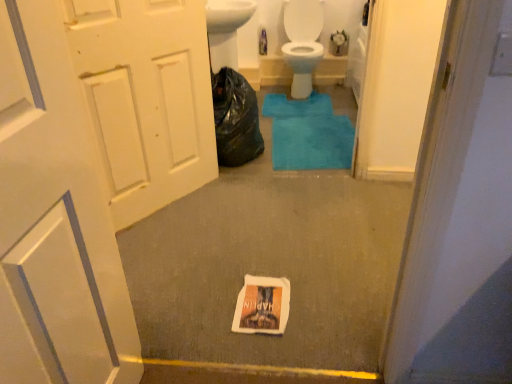
This screenshot has height=384, width=512. I want to click on white glossy toilet at center, so click(302, 65).

The image size is (512, 384). What do you see at coordinates (146, 98) in the screenshot? I see `white matte door at left, which appears as the second door when viewed from the front` at bounding box center [146, 98].

Describe the element at coordinates (234, 119) in the screenshot. This screenshot has width=512, height=384. I see `black plastic bag at center` at that location.

You are a GUI agent. You are given a task and a screenshot of the screen. Output one action in this format:
    pyautogui.click(x=<x>, y=<y>)
    Task: Click on the black plastic bag at center
    
    Given the screenshot: What is the action you would take?
    pyautogui.click(x=234, y=119)

This screenshot has width=512, height=384. I want to click on white matte door at left, arranged as the second door when viewed from the back, so click(x=57, y=211).

Locate an element on the screen. This screenshot has height=384, width=512. white glossy toilet at center is located at coordinates (302, 65).

From the image's perspective, is white matte door at left, the first door in the front-to-back sequence, located above or below white glossy toilet at center?

Based on their image positions, white matte door at left, the first door in the front-to-back sequence, is located beneath white glossy toilet at center.

Considering the relative sizes of white matte door at left, arranged as the second door when viewed from the back, and white glossy toilet at center in the image provided, is white matte door at left, arranged as the second door when viewed from the back, shorter than white glossy toilet at center?

No.

Is point (61, 128) positioned behind point (323, 49)?

No, it is not.

Is white matte door at left, arranged as the second door when viewed from the back, positioned beyond the bounds of white glossy toilet at center?

Yes.

Considering the positions of objects white paper flyer at center and black plastic bag at center in the image provided, who is more to the right, white paper flyer at center or black plastic bag at center?

Positioned to the right is white paper flyer at center.

Can you tell me how much white paper flyer at center and black plastic bag at center differ in facing direction?

white paper flyer at center and black plastic bag at center are facing 88.8 degrees away from each other.

Considering the positions of objects white paper flyer at center and black plastic bag at center in the image provided, who is in front, white paper flyer at center or black plastic bag at center?

white paper flyer at center is in front.

Where is `flyer that appears below the black plastic bag at center (from the image's perspective)`? flyer that appears below the black plastic bag at center (from the image's perspective) is located at coordinates (262, 306).

Considering the positions of point (42, 109) and point (214, 103), is point (42, 109) closer or farther from the camera than point (214, 103)?

Point (42, 109) is closer to the camera than point (214, 103).

What's the angular difference between white matte door at left, arranged as the second door when viewed from the back, and black plastic bag at center's facing directions?

They differ by 4.16 degrees in their facing directions.

From the image's perspective, which object appears higher, white matte door at left, arranged as the second door when viewed from the back, or black plastic bag at center?

black plastic bag at center, from the image's perspective.

In the image, is white matte door at left, the first door in the front-to-back sequence, positioned in front of or behind black plastic bag at center?

Clearly, white matte door at left, the first door in the front-to-back sequence, is in front of black plastic bag at center.

Considering the relative positions of white matte door at left, the first door from the back, and black plastic bag at center in the image provided, is white matte door at left, the first door from the back, to the left or to the right of black plastic bag at center?

From the image, it's evident that white matte door at left, the first door from the back, is to the left of black plastic bag at center.

Are white matte door at left, which appears as the second door when viewed from the front, and black plastic bag at center far apart?

No, white matte door at left, which appears as the second door when viewed from the front, is not far away from black plastic bag at center.

From the image's perspective, is white matte door at left, the first door from the back, under black plastic bag at center?

Yes, from the image's perspective, white matte door at left, the first door from the back, is below black plastic bag at center.

Looking at this image, is white matte door at left, arranged as the second door when viewed from the back, not inside white paper flyer at center?

white matte door at left, arranged as the second door when viewed from the back, lies outside white paper flyer at center's area.

From a real-world perspective, is white matte door at left, arranged as the second door when viewed from the back, above or below white paper flyer at center?

white matte door at left, arranged as the second door when viewed from the back, is situated higher than white paper flyer at center in the real world.

Can you confirm if white matte door at left, arranged as the second door when viewed from the back, is taller than white paper flyer at center?

Yes, white matte door at left, arranged as the second door when viewed from the back, is taller than white paper flyer at center.

Is white matte door at left, the first door from the back, turned away from white glossy toilet at center?

No, white glossy toilet at center is not at the back of white matte door at left, the first door from the back.

Image resolution: width=512 pixels, height=384 pixels. I want to click on door that is the 1st object located in front of the white glossy toilet at center, so [146, 98].

Is white matte door at left, which appears as the second door when viewed from the front, next to white glossy toilet at center?

white matte door at left, which appears as the second door when viewed from the front, and white glossy toilet at center are not in contact.

How much distance is there between white glossy toilet at center and white paper flyer at center?

white glossy toilet at center and white paper flyer at center are 2.42 meters apart.

Would you say white glossy toilet at center is a long distance from white paper flyer at center?

white glossy toilet at center is far away from white paper flyer at center.

Where is `flyer on the left of the white glossy toilet at center`? flyer on the left of the white glossy toilet at center is located at coordinates (262, 306).

Which point is more forward, (285, 48) or (280, 314)?

The point (280, 314) is closer to the camera.

From a real-world perspective, count 2nd doors upward from the white glossy toilet at center and point to it. Please provide its 2D coordinates.

[(57, 211)]

Locate an element on the screen. The width and height of the screenshot is (512, 384). paper bag on the left of white paper flyer at center is located at coordinates (234, 119).

Which object lies further to the anchor point white paper flyer at center, teal plush bath mat at center or white matte door at left, arranged as the second door when viewed from the back?

Among the two, teal plush bath mat at center is located further to white paper flyer at center.

Considering their positions, is white glossy toilet at center positioned closer to black plastic bag at center than teal plush bath mat at center?

Among the two, teal plush bath mat at center is located nearer to black plastic bag at center.

Which object lies nearer to the anchor point teal plush bath mat at center, white matte door at left, the first door from the back, or white glossy toilet at center?

The object closer to teal plush bath mat at center is white glossy toilet at center.

From the picture: Estimate the real-world distances between objects in this image. Which object is closer to teal plush bath mat at center, white paper flyer at center or white matte door at left, the first door from the back?

white matte door at left, the first door from the back.

Based on the photo, from the image, which object appears to be nearer to white matte door at left, the first door in the front-to-back sequence, white matte door at left, the first door from the back, or white glossy toilet at center?

white matte door at left, the first door from the back.

Based on their spatial positions, is white glossy toilet at center or black plastic bag at center further from white paper flyer at center?

Among the two, white glossy toilet at center is located further to white paper flyer at center.

Based on the photo, looking at the image, which one is located further to teal plush bath mat at center, white matte door at left, which appears as the second door when viewed from the front, or white paper flyer at center?

white paper flyer at center is positioned further to the anchor teal plush bath mat at center.

Which object lies nearer to the anchor point white glossy toilet at center, white matte door at left, which appears as the second door when viewed from the front, or teal plush bath mat at center?

Among the two, teal plush bath mat at center is located nearer to white glossy toilet at center.

This screenshot has width=512, height=384. I want to click on door positioned between white matte door at left, the first door in the front-to-back sequence, and white paper flyer at center from near to far, so click(146, 98).

Find the location of a particular element. door between white matte door at left, arranged as the second door when viewed from the back, and black plastic bag at center, along the z-axis is located at coordinates (146, 98).

This screenshot has height=384, width=512. What are the coordinates of `flyer between white matte door at left, the first door from the back, and white glossy toilet at center in the front-back direction` in the screenshot? It's located at (262, 306).

Find the location of a particular element. paper bag between white glossy toilet at center and teal plush bath mat at center from top to bottom is located at coordinates click(x=234, y=119).